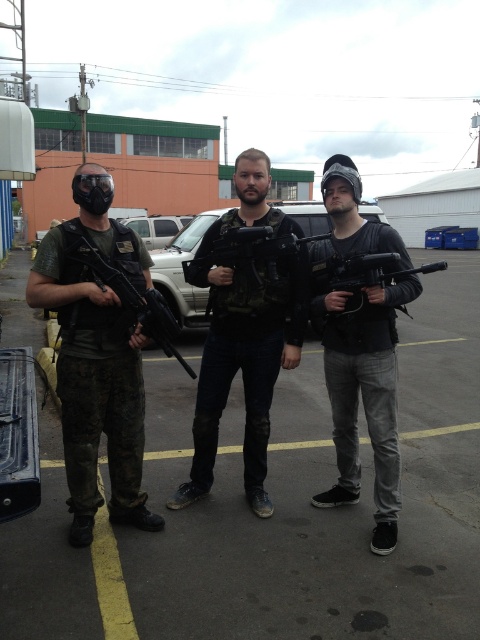
Between point (229, 532) and point (137, 326), which one is positioned in front?

Positioned in front is point (137, 326).

Does concrete pavement at center have a lesser width compared to matte black vest at left?

No.

You are a GUI agent. You are given a task and a screenshot of the screen. Output one action in this format:
    pyautogui.click(x=<x>, y=<y>)
    Task: Click on the concrete pavement at center
    This screenshot has width=480, height=640.
    Given the screenshot: What is the action you would take?
    pyautogui.click(x=321, y=509)

You are a GUI agent. You are given a task and a screenshot of the screen. Output one action in this format:
    pyautogui.click(x=<x>, y=<y>)
    Task: Click on the concrete pavement at center
    This screenshot has width=480, height=640.
    Given the screenshot: What is the action you would take?
    pyautogui.click(x=321, y=509)

Does point (85, 198) come in front of point (338, 456)?

Yes, it is in front of point (338, 456).

Who is positioned more to the left, matte black vest at left or matte black helmet at center?

matte black vest at left

Does point (96, 188) come closer to viewer compared to point (394, 246)?

Yes, point (96, 188) is closer to viewer.

You are a GUI agent. You are given a task and a screenshot of the screen. Output one action in this format:
    pyautogui.click(x=<x>, y=<y>)
    Task: Click on the matte black vest at left
    
    Given the screenshot: What is the action you would take?
    pyautogui.click(x=96, y=358)

Does concrete pavement at center have a greater height compared to matte black gun at center?

Yes, concrete pavement at center is taller than matte black gun at center.

Locate an element on the screen. Image resolution: width=480 pixels, height=640 pixels. concrete pavement at center is located at coordinates (321, 509).

Locate an element on the screen. Image resolution: width=480 pixels, height=640 pixels. concrete pavement at center is located at coordinates (321, 509).